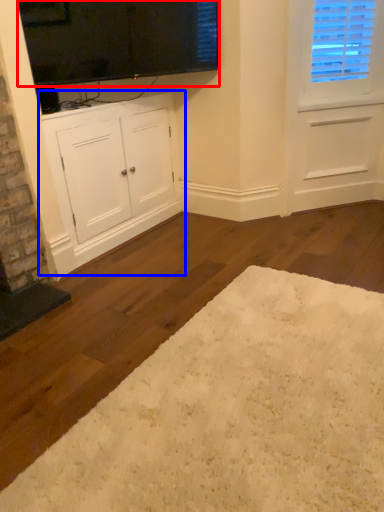
Question: Which point is closer to the camera, window screen (highlighted by a red box) or cabinetry (highlighted by a blue box)?

Choices:
 (A) window screen
 (B) cabinetry

Answer: (A)